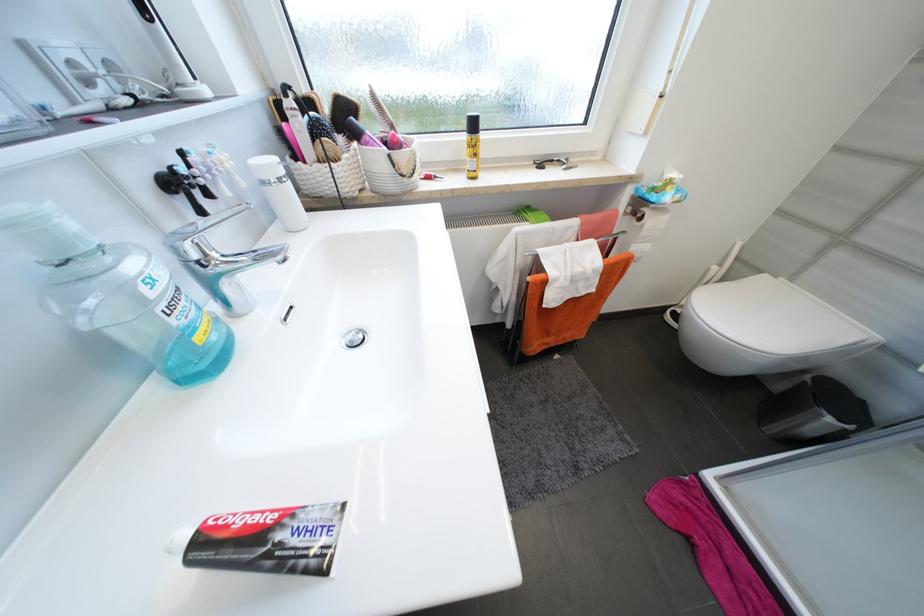
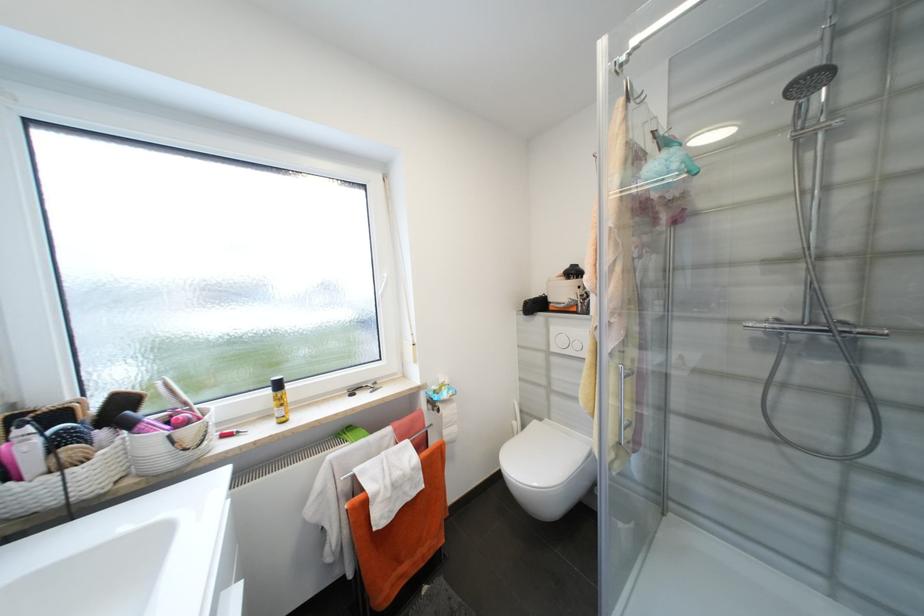
In the second image, find the point that corresponds to the point at 647,219 in the first image.

(444, 411)